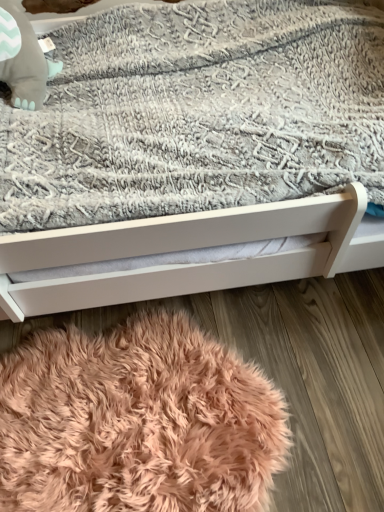
Question: Is matte gray plush baby elephant at upper left completely or partially inside white matte bed at center?

Choices:
 (A) no
 (B) yes

Answer: (B)

Question: Can you confirm if white matte bed at center is bigger than matte gray plush baby elephant at upper left?

Choices:
 (A) no
 (B) yes

Answer: (B)

Question: Does white matte bed at center have a greater width compared to matte gray plush baby elephant at upper left?

Choices:
 (A) yes
 (B) no

Answer: (A)

Question: From the image's perspective, does white matte bed at center appear higher than matte gray plush baby elephant at upper left?

Choices:
 (A) yes
 (B) no

Answer: (B)

Question: Is white matte bed at center positioned behind matte gray plush baby elephant at upper left?

Choices:
 (A) yes
 (B) no

Answer: (B)

Question: Considering the positions of white matte bed at center and matte gray plush baby elephant at upper left in the image, is white matte bed at center bigger or smaller than matte gray plush baby elephant at upper left?

Choices:
 (A) small
 (B) big

Answer: (B)

Question: From a real-world perspective, relative to matte gray plush baby elephant at upper left, is white matte bed at center vertically above or below?

Choices:
 (A) below
 (B) above

Answer: (A)

Question: In the image, is white matte bed at center positioned in front of or behind matte gray plush baby elephant at upper left?

Choices:
 (A) behind
 (B) front

Answer: (B)

Question: From the image's perspective, is white matte bed at center located above or below matte gray plush baby elephant at upper left?

Choices:
 (A) above
 (B) below

Answer: (B)

Question: Does point (16, 52) appear closer or farther from the camera than point (89, 397)?

Choices:
 (A) farther
 (B) closer

Answer: (A)

Question: Is matte gray plush baby elephant at upper left bigger or smaller than peachy soft rug at lower center?

Choices:
 (A) small
 (B) big

Answer: (A)

Question: Relative to peachy soft rug at lower center, is matte gray plush baby elephant at upper left in front or behind?

Choices:
 (A) front
 (B) behind

Answer: (B)

Question: From a real-world perspective, relative to peachy soft rug at lower center, is matte gray plush baby elephant at upper left vertically above or below?

Choices:
 (A) above
 (B) below

Answer: (A)

Question: Is white matte bed at center bigger or smaller than peachy soft rug at lower center?

Choices:
 (A) small
 (B) big

Answer: (B)

Question: From their relative heights in the image, would you say white matte bed at center is taller or shorter than peachy soft rug at lower center?

Choices:
 (A) tall
 (B) short

Answer: (A)